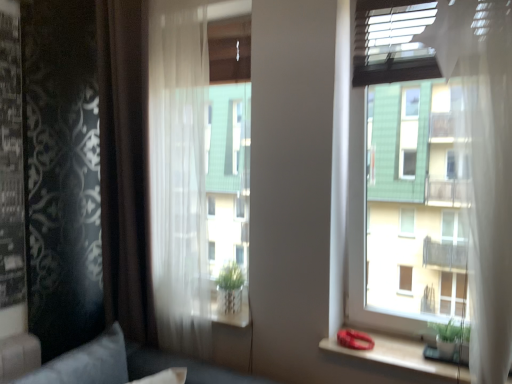
Question: Can you confirm if transparent glass window at upper right is shorter than velvet gray pillow at lower left?

Choices:
 (A) yes
 (B) no

Answer: (B)

Question: Is transparent glass window at upper right not close to velvet gray pillow at lower left?

Choices:
 (A) yes
 (B) no

Answer: (A)

Question: Can you confirm if transparent glass window at upper right is taller than velvet gray pillow at lower left?

Choices:
 (A) yes
 (B) no

Answer: (A)

Question: Would you say velvet gray pillow at lower left is part of transparent glass window at upper right's contents?

Choices:
 (A) no
 (B) yes

Answer: (A)

Question: Considering the relative positions of transparent glass window at upper right and velvet gray pillow at lower left in the image provided, is transparent glass window at upper right to the left of velvet gray pillow at lower left from the viewer's perspective?

Choices:
 (A) yes
 (B) no

Answer: (B)

Question: Is transparent glass window at upper right bigger than velvet gray pillow at lower left?

Choices:
 (A) no
 (B) yes

Answer: (B)

Question: Is the position of transparent glass window at upper right more distant than that of brown sheer curtain at left, which is the 2th curtain from right to left?

Choices:
 (A) no
 (B) yes

Answer: (A)

Question: Could you tell me if transparent glass window at upper right is turned towards brown sheer curtain at left, positioned as the 1th curtain in left-to-right order?

Choices:
 (A) yes
 (B) no

Answer: (B)

Question: Can you confirm if transparent glass window at upper right is positioned to the right of brown sheer curtain at left, positioned as the 1th curtain in left-to-right order?

Choices:
 (A) no
 (B) yes

Answer: (B)

Question: Does transparent glass window at upper right have a greater height compared to brown sheer curtain at left, positioned as the 1th curtain in left-to-right order?

Choices:
 (A) yes
 (B) no

Answer: (B)

Question: Is brown sheer curtain at left, positioned as the 1th curtain in left-to-right order, inside transparent glass window at upper right?

Choices:
 (A) yes
 (B) no

Answer: (B)

Question: Would you say transparent glass window at upper right is a long distance from brown sheer curtain at left, which is the 2th curtain from right to left?

Choices:
 (A) no
 (B) yes

Answer: (B)

Question: Are brown sheer curtain at left, positioned as the 1th curtain in left-to-right order, and velvet gray pillow at lower left making contact?

Choices:
 (A) yes
 (B) no

Answer: (B)